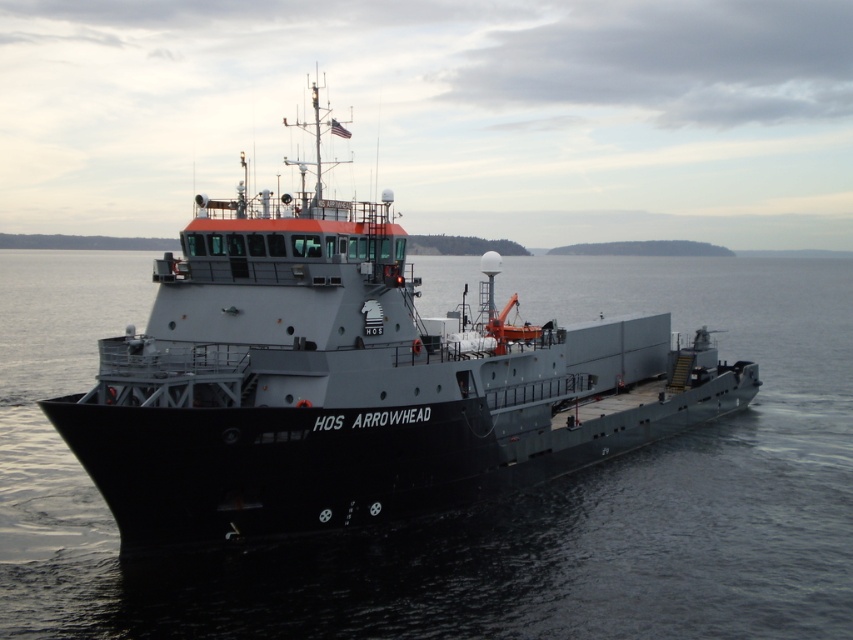
Question: Can you confirm if black matte water at center is bigger than black matte ship at center?

Choices:
 (A) yes
 (B) no

Answer: (A)

Question: Does black matte water at center have a greater width compared to black matte ship at center?

Choices:
 (A) no
 (B) yes

Answer: (B)

Question: Which of the following is the farthest from the observer?

Choices:
 (A) (90, 324)
 (B) (213, 298)

Answer: (A)

Question: Which object appears farthest from the camera in this image?

Choices:
 (A) black matte ship at center
 (B) black matte water at center

Answer: (A)

Question: Can you confirm if black matte water at center is positioned to the left of black matte ship at center?

Choices:
 (A) no
 (B) yes

Answer: (A)

Question: Which of the following is the farthest from the observer?

Choices:
 (A) black matte water at center
 (B) black matte ship at center

Answer: (B)